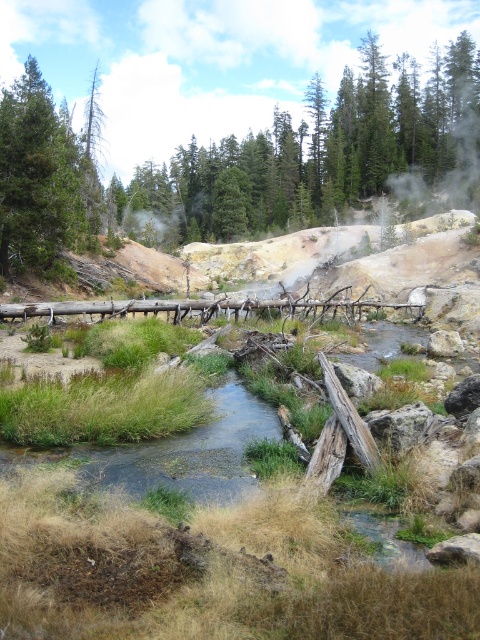
Question: Is green coniferous trees at upper center to the left of green matte tree at upper left from the viewer's perspective?

Choices:
 (A) yes
 (B) no

Answer: (B)

Question: Does green coniferous trees at upper center appear on the left side of green matte tree at upper left?

Choices:
 (A) yes
 (B) no

Answer: (B)

Question: Which of the following is the closest to the observer?

Choices:
 (A) (343, 138)
 (B) (73, 208)

Answer: (B)

Question: Can you confirm if green coniferous trees at upper center is smaller than green matte tree at upper left?

Choices:
 (A) no
 (B) yes

Answer: (A)

Question: Which point is farther to the camera?

Choices:
 (A) green coniferous trees at upper center
 (B) green matte tree at upper left

Answer: (A)

Question: Which point is farther to the camera?

Choices:
 (A) green matte tree at upper left
 (B) green coniferous trees at upper center

Answer: (B)